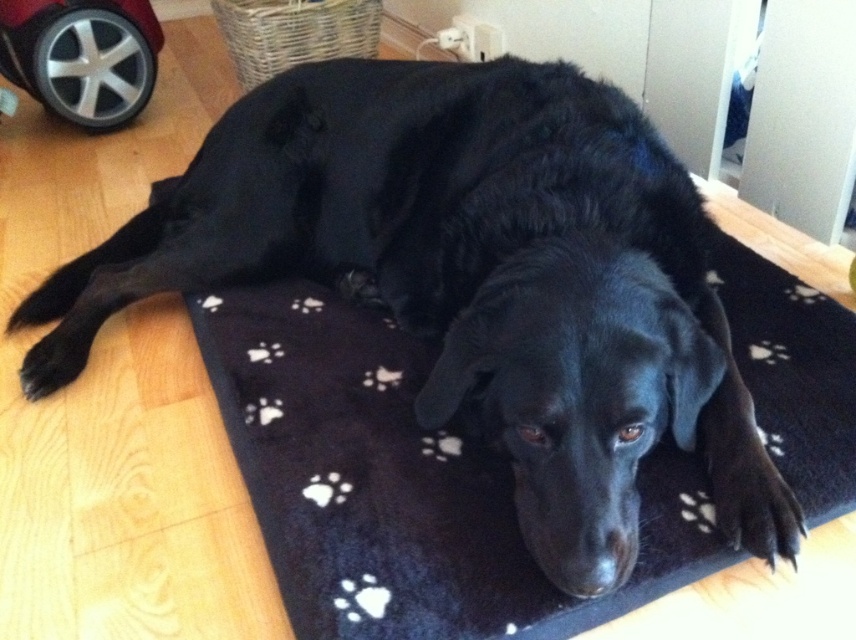
Question: Considering the relative positions of black fleece dog bed at center and black fur paw at lower left in the image provided, where is black fleece dog bed at center located with respect to black fur paw at lower left?

Choices:
 (A) below
 (B) above

Answer: (A)

Question: Which object is farther from the camera taking this photo?

Choices:
 (A) black fuzzy paw at lower right
 (B) black fur paw at lower left
 (C) black fleece dog bed at center

Answer: (B)

Question: From the image, what is the correct spatial relationship of black fleece dog bed at center in relation to black fur paw at lower left?

Choices:
 (A) right
 (B) left

Answer: (A)

Question: Does black fleece dog bed at center have a larger size compared to black fur paw at lower left?

Choices:
 (A) yes
 (B) no

Answer: (A)

Question: Estimate the real-world distances between objects in this image. Which object is farther from the black fuzzy paw at lower right?

Choices:
 (A) black fleece dog bed at center
 (B) black fur paw at lower left

Answer: (B)

Question: Which of the following is the closest to the observer?

Choices:
 (A) black fleece dog bed at center
 (B) black fur paw at lower left
 (C) black fuzzy paw at lower right

Answer: (A)